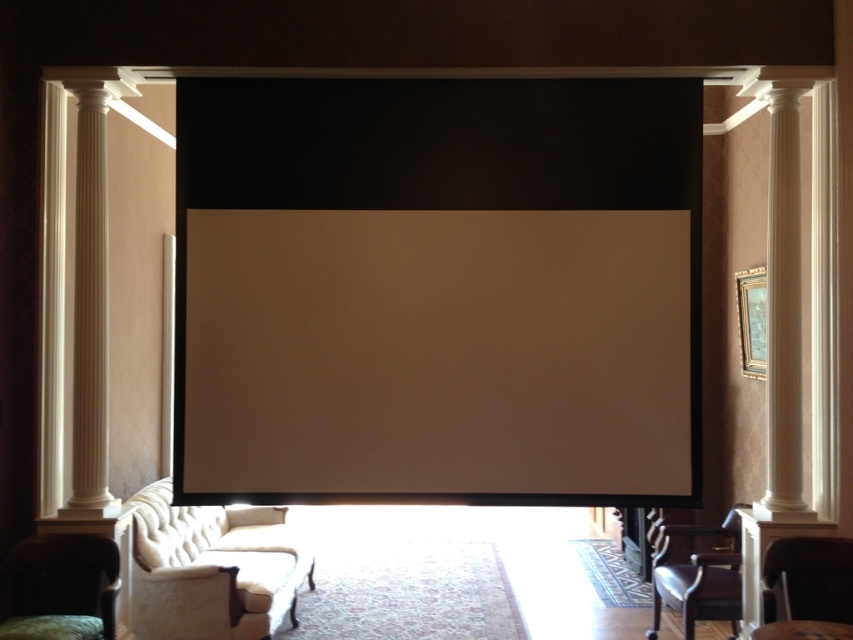
Between white tufted fabric couch at lower left and matte white armchair at lower right, which one appears on the left side from the viewer's perspective?

white tufted fabric couch at lower left is more to the left.

Is point (241, 576) behind point (840, 596)?

Yes, point (241, 576) is farther from viewer.

In order to click on white tufted fabric couch at lower left in this screenshot , I will do `click(213, 568)`.

Is white tufted fabric couch at lower left in front of white smooth column at right?

No, it is behind white smooth column at right.

Identify the location of white tufted fabric couch at lower left. (213, 568).

This screenshot has height=640, width=853. Describe the element at coordinates (213, 568) in the screenshot. I see `white tufted fabric couch at lower left` at that location.

Where is `white tufted fabric couch at lower left`? white tufted fabric couch at lower left is located at coordinates click(213, 568).

Does point (331, 371) lie behind point (733, 568)?

No, it is not.

Between point (500, 280) and point (672, 577), which one is positioned behind?

Positioned behind is point (672, 577).

Is point (450, 483) closer to viewer compared to point (730, 577)?

Yes, point (450, 483) is closer to viewer.

You are a GUI agent. You are given a task and a screenshot of the screen. Output one action in this format:
    pyautogui.click(x=<x>, y=<y>)
    Task: Click on the matte white screen at center
    Image resolution: width=853 pixels, height=640 pixels.
    Given the screenshot: What is the action you would take?
    pos(437,353)